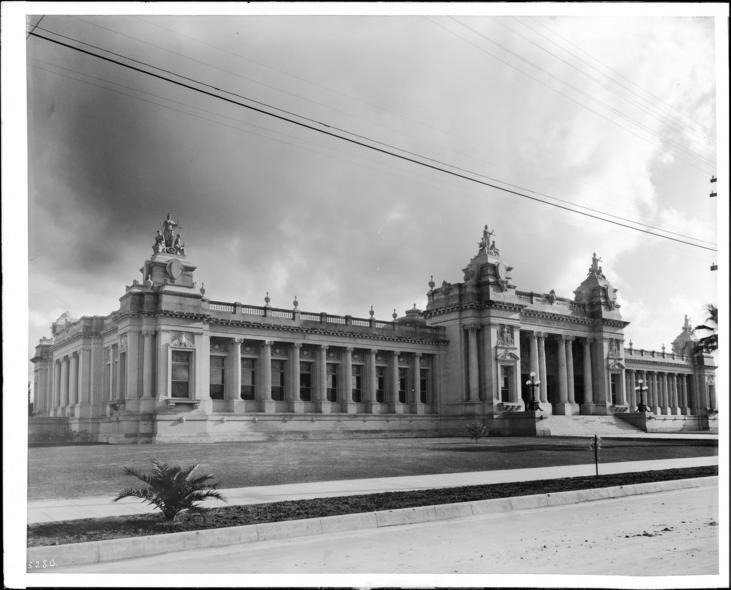
Where is `plant`? The width and height of the screenshot is (731, 590). plant is located at coordinates (174, 485).